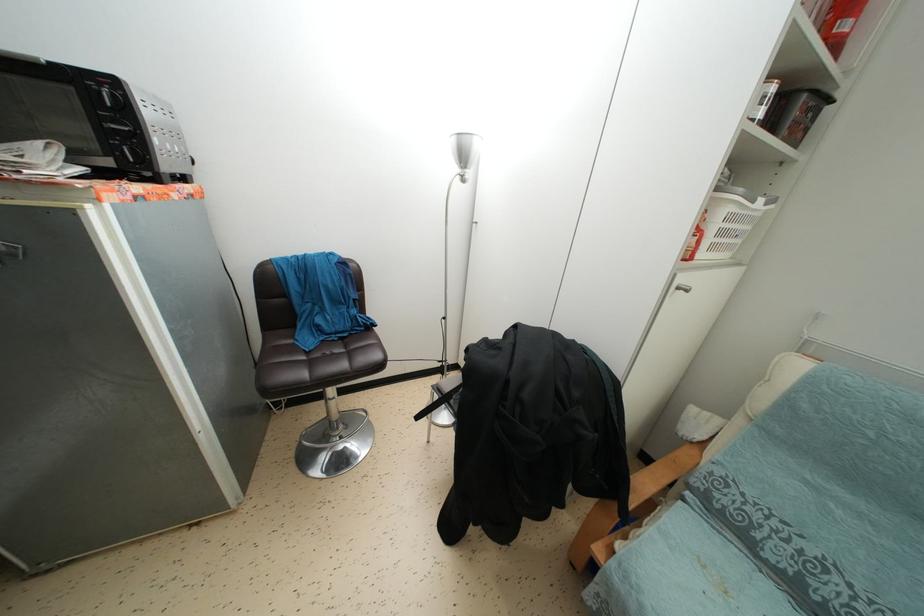
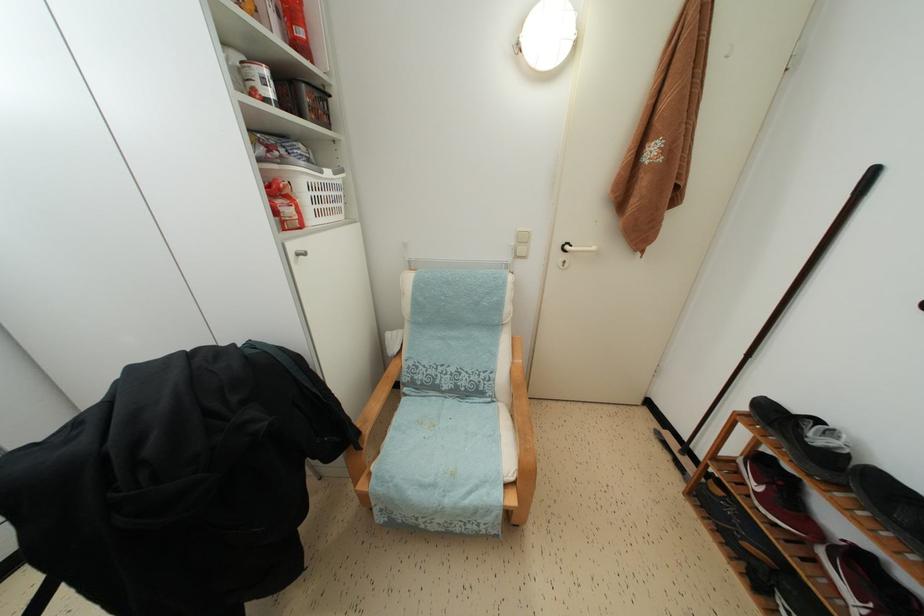
In the second image, find the point that corresponds to pixel 725 238 in the first image.

(319, 206)